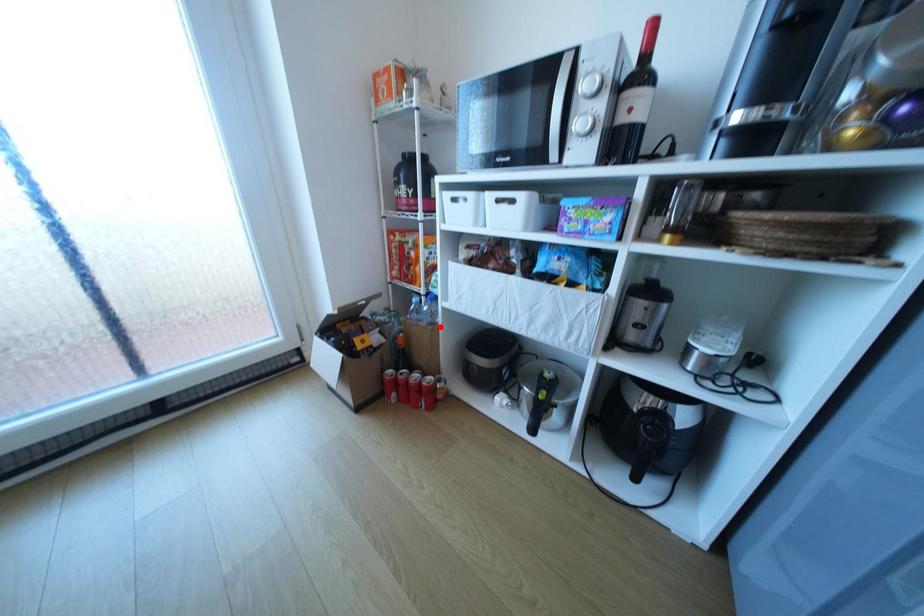
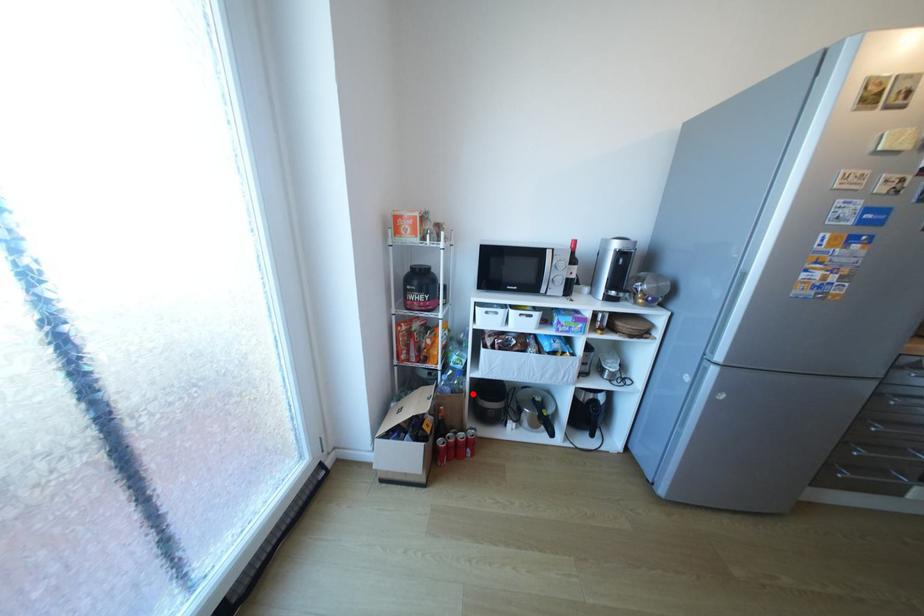
I am providing you with two images of the same scene from different viewpoints. A red point is marked on the first image and another point is marked on the second image. Are the points marked in image1 and image2 representing the same 3D position?

Yes